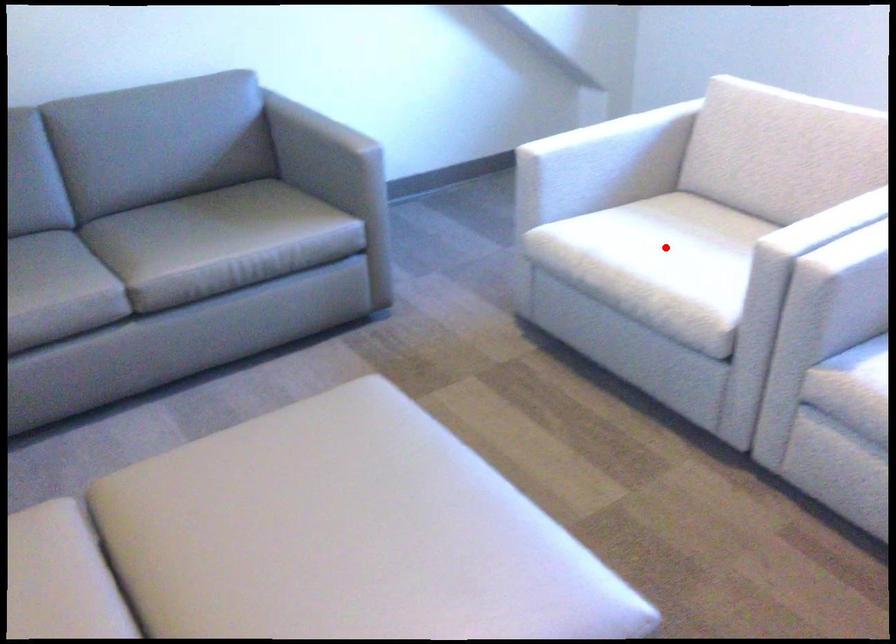
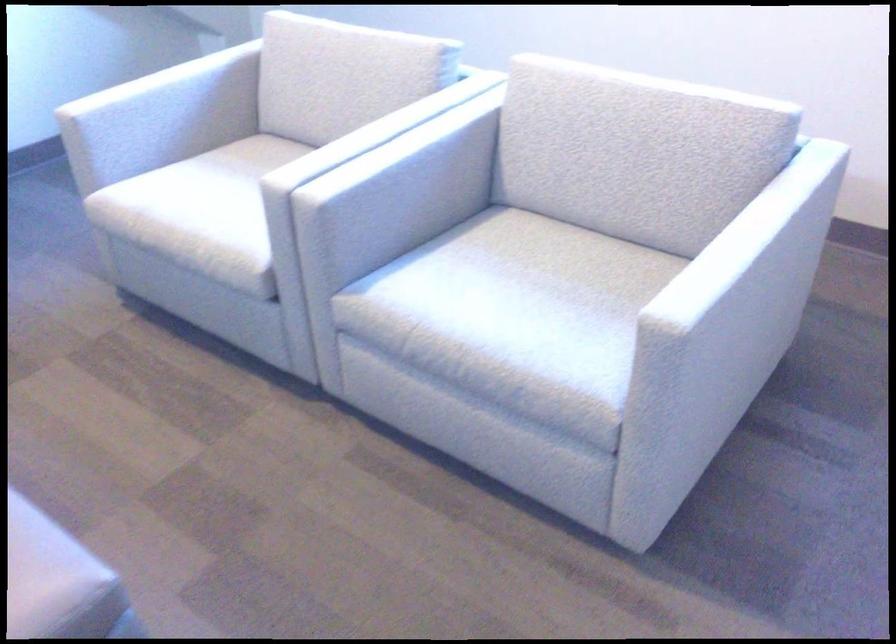
Question: I am providing you with two images of the same scene from different viewpoints. A red point is marked on the first image. Is the red point's position out of view in image 2?

Choices:
 (A) Yes
 (B) No

Answer: (B)